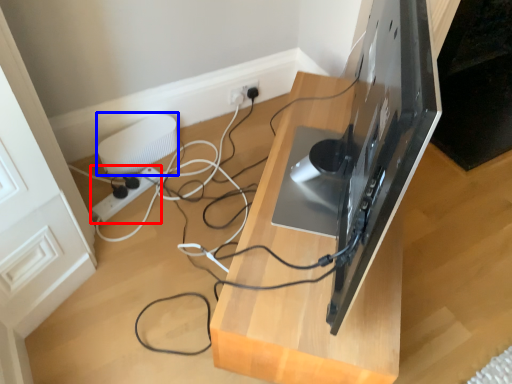
Question: Which object appears closest to the camera in this image, extension cord (highlighted by a red box) or appliance (highlighted by a blue box)?

Choices:
 (A) extension cord
 (B) appliance

Answer: (A)